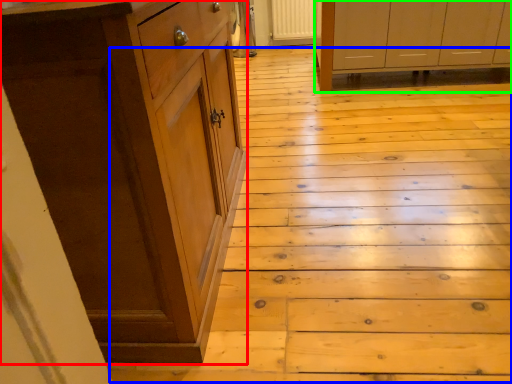
Question: Which is farther away from cabinetry (highlighted by a red box)? stair (highlighted by a blue box) or cabinetry (highlighted by a green box)?

Choices:
 (A) stair
 (B) cabinetry

Answer: (B)